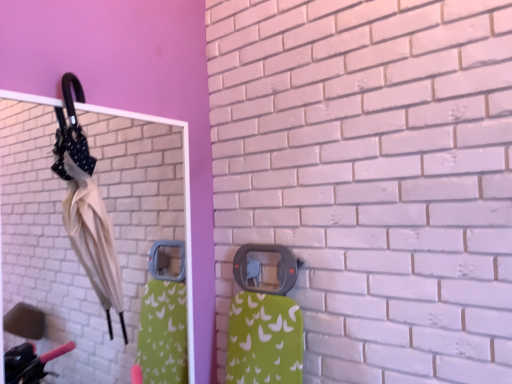
Question: From a real-world perspective, is beige fabric umbrella at left under white glossy mirror at upper left?

Choices:
 (A) no
 (B) yes

Answer: (A)

Question: Is beige fabric umbrella at left shorter than white glossy mirror at upper left?

Choices:
 (A) yes
 (B) no

Answer: (A)

Question: Is beige fabric umbrella at left smaller than white glossy mirror at upper left?

Choices:
 (A) no
 (B) yes

Answer: (B)

Question: From a real-world perspective, is beige fabric umbrella at left physically above white glossy mirror at upper left?

Choices:
 (A) yes
 (B) no

Answer: (A)

Question: Does beige fabric umbrella at left lie in front of white glossy mirror at upper left?

Choices:
 (A) no
 (B) yes

Answer: (A)

Question: Does beige fabric umbrella at left have a greater width compared to white glossy mirror at upper left?

Choices:
 (A) no
 (B) yes

Answer: (B)

Question: Is white glossy mirror at upper left not close to beige fabric umbrella at left?

Choices:
 (A) no
 (B) yes

Answer: (B)

Question: Does white glossy mirror at upper left have a greater height compared to beige fabric umbrella at left?

Choices:
 (A) yes
 (B) no

Answer: (A)

Question: Is white glossy mirror at upper left looking in the opposite direction of beige fabric umbrella at left?

Choices:
 (A) yes
 (B) no

Answer: (A)

Question: Is white glossy mirror at upper left smaller than beige fabric umbrella at left?

Choices:
 (A) yes
 (B) no

Answer: (B)

Question: Is white glossy mirror at upper left thinner than beige fabric umbrella at left?

Choices:
 (A) no
 (B) yes

Answer: (B)

Question: Can you confirm if white glossy mirror at upper left is wider than beige fabric umbrella at left?

Choices:
 (A) yes
 (B) no

Answer: (B)

Question: From a real-world perspective, is beige fabric umbrella at left below matte plastic door handle at center?

Choices:
 (A) no
 (B) yes

Answer: (A)